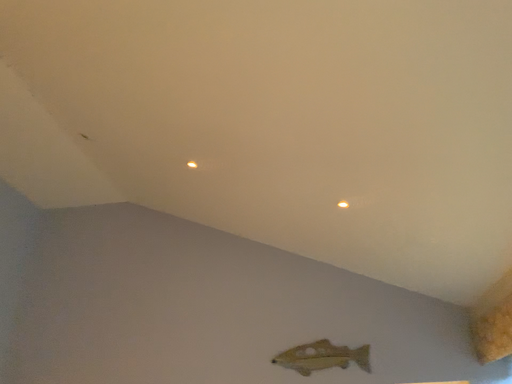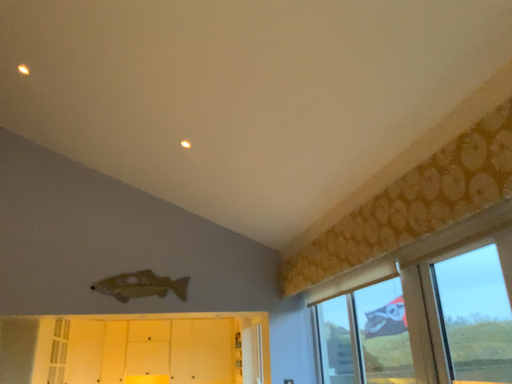
Question: Which way did the camera rotate in the video?

Choices:
 (A) rotated downward
 (B) rotated upward

Answer: (A)